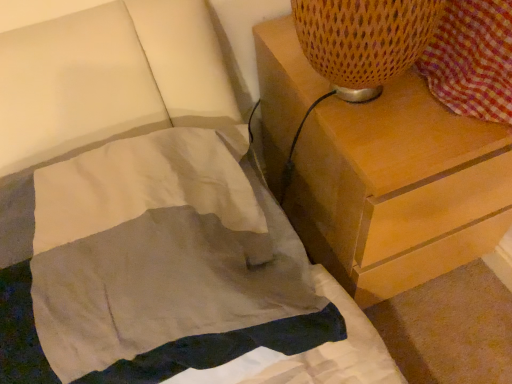
Question: In terms of size, does light gray cotton blanket at lower left appear bigger or smaller than wooden chest of drawers at upper right?

Choices:
 (A) small
 (B) big

Answer: (A)

Question: From a real-world perspective, is light gray cotton blanket at lower left physically located above or below wooden chest of drawers at upper right?

Choices:
 (A) above
 (B) below

Answer: (A)

Question: From their relative heights in the image, would you say light gray cotton blanket at lower left is taller or shorter than wooden chest of drawers at upper right?

Choices:
 (A) short
 (B) tall

Answer: (A)

Question: Is wooden chest of drawers at upper right inside or outside of light gray cotton blanket at lower left?

Choices:
 (A) outside
 (B) inside

Answer: (A)

Question: In terms of height, does wooden chest of drawers at upper right look taller or shorter compared to light gray cotton blanket at lower left?

Choices:
 (A) short
 (B) tall

Answer: (B)

Question: Is wooden chest of drawers at upper right to the left or to the right of light gray cotton blanket at lower left in the image?

Choices:
 (A) right
 (B) left

Answer: (A)

Question: Considering their positions, is wooden chest of drawers at upper right located in front of or behind light gray cotton blanket at lower left?

Choices:
 (A) front
 (B) behind

Answer: (B)